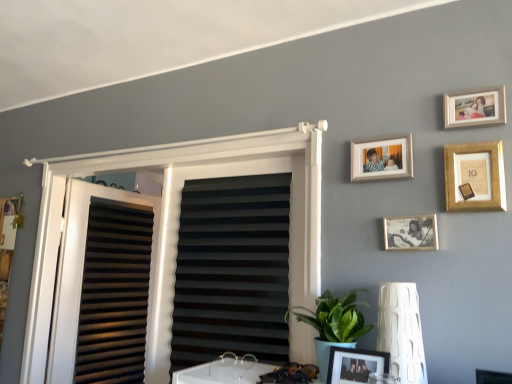
Locate an element on the screen. This screenshot has height=384, width=512. empty space that is ontop of black matte window blind at center is located at coordinates (231, 162).